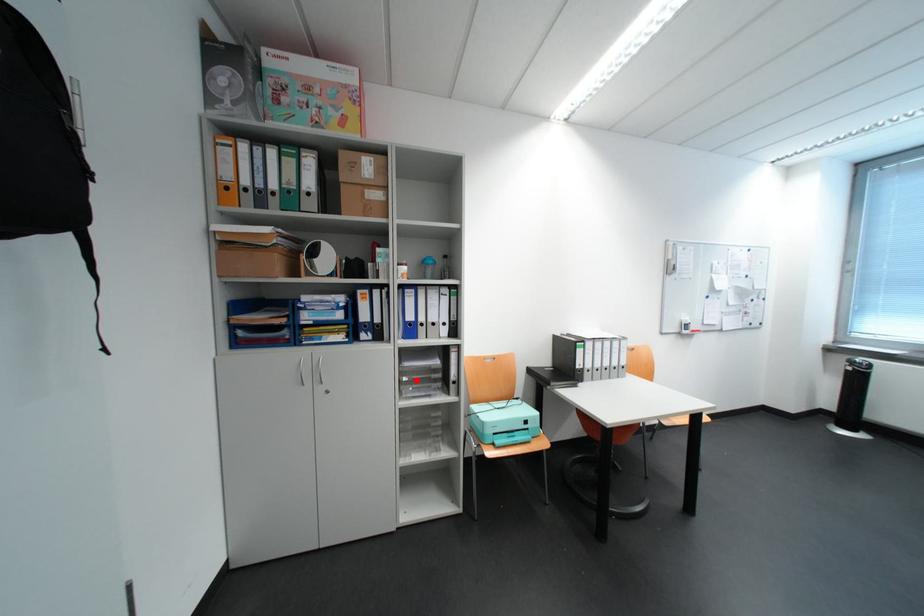
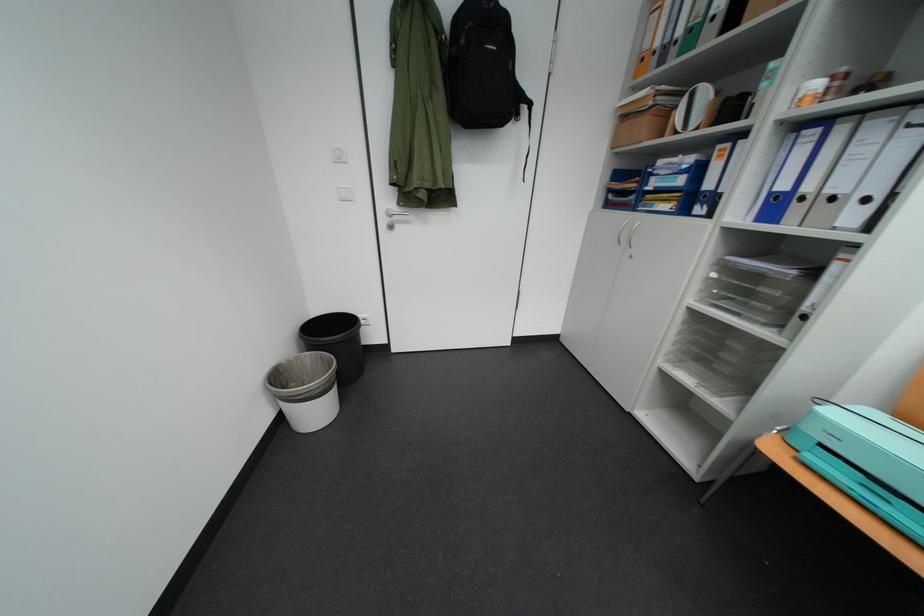
Find the pixel in the second image that matches the highlighted location in the first image.

(724, 277)